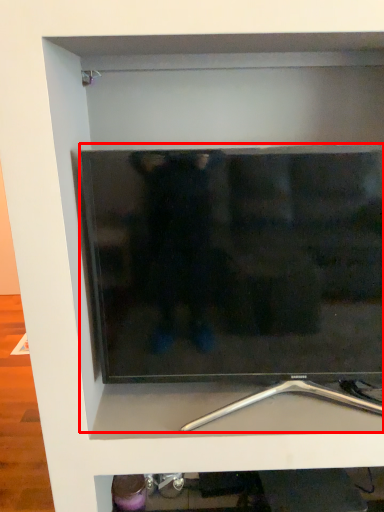
Question: From the image, what is the correct spatial relationship of television (annotated by the red box) in relation to silver?

Choices:
 (A) right
 (B) left

Answer: (B)